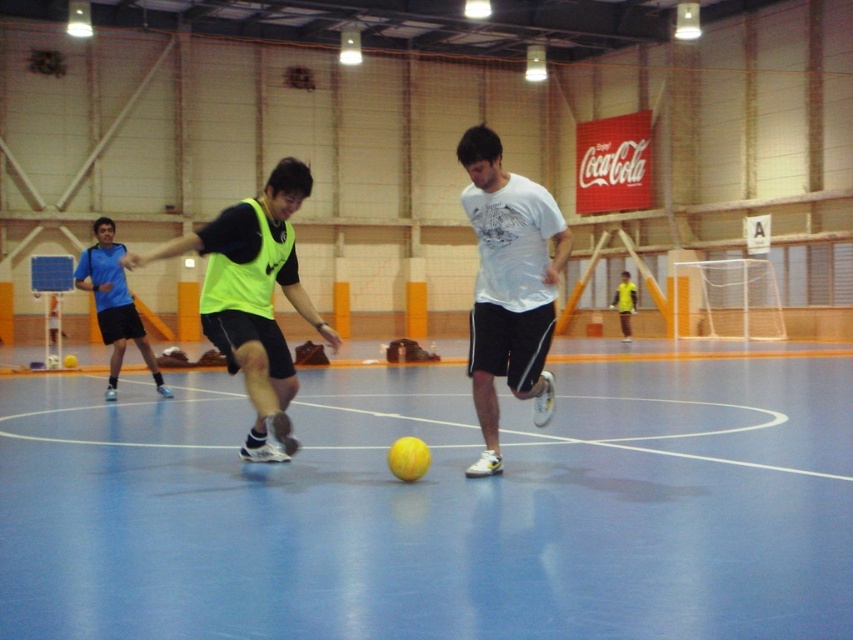
Consider the image. Between neon yellow jersey at center and yellow matte shirt at center, which one appears on the left side from the viewer's perspective?

neon yellow jersey at center

Between point (112, 262) and point (630, 339), which one is positioned behind?

Point (630, 339)

Which is behind, point (102, 243) or point (630, 284)?

Point (630, 284)

You are a GUI agent. You are given a task and a screenshot of the screen. Output one action in this format:
    pyautogui.click(x=<x>, y=<y>)
    Task: Click on the neon yellow jersey at center
    The width and height of the screenshot is (853, 640).
    Given the screenshot: What is the action you would take?
    pyautogui.click(x=113, y=304)

In the scene shown: Is white matte t-shirt at center taller than neon yellow vest at center?

Correct, white matte t-shirt at center is much taller as neon yellow vest at center.

Where is `white matte t-shirt at center`? This screenshot has height=640, width=853. white matte t-shirt at center is located at coordinates (508, 285).

Is white matte t-shirt at center to the left of yellow matte shirt at center from the viewer's perspective?

Yes, white matte t-shirt at center is to the left of yellow matte shirt at center.

Which is more to the right, white matte t-shirt at center or yellow matte shirt at center?

yellow matte shirt at center

Locate an element on the screen. This screenshot has height=640, width=853. white matte t-shirt at center is located at coordinates (508, 285).

I want to click on white matte t-shirt at center, so click(508, 285).